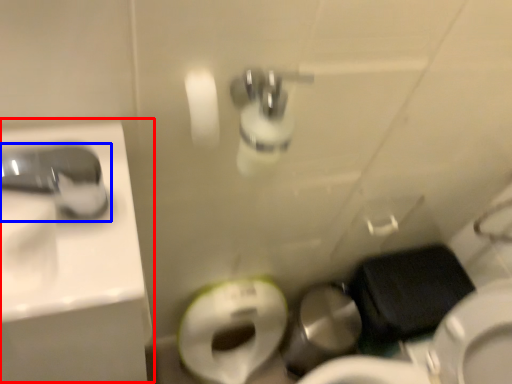
Question: Which of the following is the farthest to the observer, sink (highlighted by a red box) or tap (highlighted by a blue box)?

Choices:
 (A) sink
 (B) tap

Answer: (A)